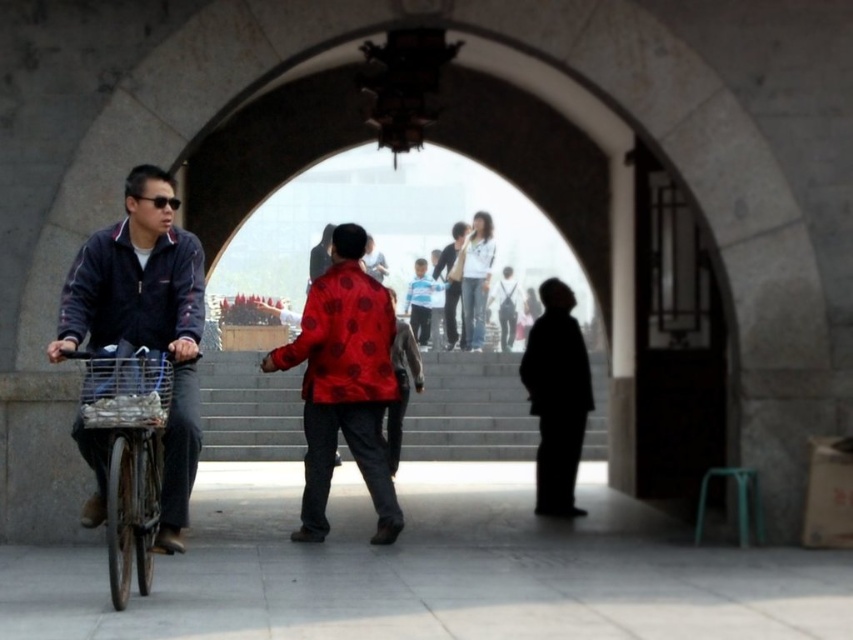
Question: In this image, where is dark blue denim jacket at left located relative to silhouette fabric at center?

Choices:
 (A) left
 (B) right

Answer: (A)

Question: Which object is positioned farthest from the metallic silver bicycle at left?

Choices:
 (A) dark blue denim jacket at left
 (B) red dotted fabric at center
 (C) matte blue jacket at left

Answer: (B)

Question: Which point appears farthest from the camera in this image?

Choices:
 (A) (537, 376)
 (B) (169, 204)

Answer: (A)

Question: Does dark blue denim jacket at left have a smaller size compared to silhouette fabric at center?

Choices:
 (A) yes
 (B) no

Answer: (A)

Question: Can you confirm if matte red blouse at center is positioned to the right of matte black jacket at center?

Choices:
 (A) no
 (B) yes

Answer: (B)

Question: Estimate the real-world distances between objects in this image. Which object is farther from the matte blue jacket at left?

Choices:
 (A) dark blue denim jacket at left
 (B) matte red blouse at center

Answer: (B)